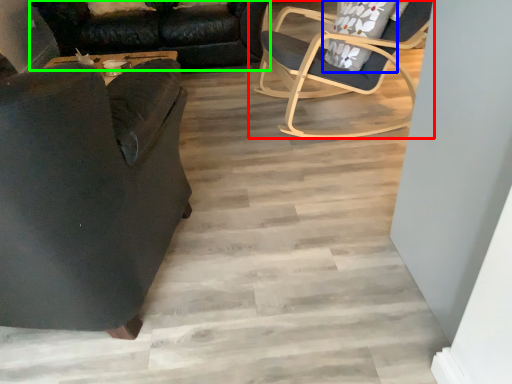
Question: Which is nearer to the chair (highlighted by a red box)? pillow (highlighted by a blue box) or studio couch (highlighted by a green box).

Choices:
 (A) pillow
 (B) studio couch

Answer: (A)